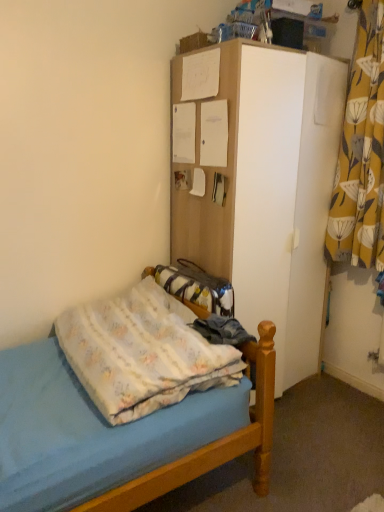
Question: Is yellow floral fabric curtain at right thinner than white matte cabinet at upper center?

Choices:
 (A) no
 (B) yes

Answer: (B)

Question: Considering the relative positions of yellow floral fabric curtain at right and white matte cabinet at upper center in the image provided, is yellow floral fabric curtain at right in front of white matte cabinet at upper center?

Choices:
 (A) no
 (B) yes

Answer: (A)

Question: Is yellow floral fabric curtain at right not within white matte cabinet at upper center?

Choices:
 (A) no
 (B) yes

Answer: (B)

Question: Would you say white matte cabinet at upper center is part of yellow floral fabric curtain at right's contents?

Choices:
 (A) yes
 (B) no

Answer: (B)

Question: Does yellow floral fabric curtain at right have a larger size compared to white matte cabinet at upper center?

Choices:
 (A) no
 (B) yes

Answer: (A)

Question: From the image's perspective, relative to white matte cabinet at upper center, is light blue fabric bed at lower left above or below?

Choices:
 (A) above
 (B) below

Answer: (B)

Question: Considering the relative positions of light blue fabric bed at lower left and white matte cabinet at upper center in the image provided, is light blue fabric bed at lower left to the left or to the right of white matte cabinet at upper center?

Choices:
 (A) left
 (B) right

Answer: (A)

Question: Does point (195, 444) appear closer or farther from the camera than point (319, 282)?

Choices:
 (A) farther
 (B) closer

Answer: (B)

Question: Is light blue fabric bed at lower left taller or shorter than white matte cabinet at upper center?

Choices:
 (A) tall
 (B) short

Answer: (B)

Question: From their relative heights in the image, would you say yellow floral fabric curtain at right is taller or shorter than light blue fabric bed at lower left?

Choices:
 (A) short
 (B) tall

Answer: (B)

Question: Considering the positions of point (359, 178) and point (94, 496), is point (359, 178) closer or farther from the camera than point (94, 496)?

Choices:
 (A) closer
 (B) farther

Answer: (B)

Question: Choose the correct answer: Is yellow floral fabric curtain at right inside light blue fabric bed at lower left or outside it?

Choices:
 (A) outside
 (B) inside

Answer: (A)

Question: In terms of width, does yellow floral fabric curtain at right look wider or thinner when compared to light blue fabric bed at lower left?

Choices:
 (A) wide
 (B) thin

Answer: (B)

Question: Does point (274, 67) appear closer or farther from the camera than point (263, 414)?

Choices:
 (A) farther
 (B) closer

Answer: (A)

Question: In the image, is white matte cabinet at upper center on the left side or the right side of light blue fabric bed at lower left?

Choices:
 (A) left
 (B) right

Answer: (B)